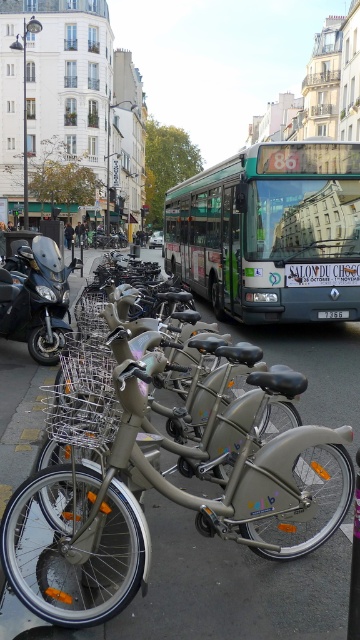
From the picture: You are standing on the sidewalk in front of the Velib bicycles. You want to walk to the bus stop located at the end of the street. The bus stop is 5 meters away from you. Can you walk directly to the bus stop without stepping on the gray asphalt at center?

The gray asphalt at center is 2.84 meters away from you. Since the bus stop is 5 meters away, you can walk around the gray asphalt at center and reach the bus stop without stepping on it.

You are a delivery person who needs to place a box on the gray asphalt at center. The box is 1 meter tall. Can the box be placed there without exceeding the height limit imposed by the green metallic bus at center?

The gray asphalt at center has a lesser height compared to the green metallic bus at center. Since the asphalt is lower, the box can be placed there as its height won

You are a delivery person who needs to park your motorcycle near the Velib bicycles. The motorcycle must be placed to the left of the bus. Given that the green metallic bus at center is already positioned to the right of the matte black motorcycle at left, is your motorcycle already in the correct position?

Yes, the matte black motorcycle at left is already positioned to the left of the green metallic bus at center, so it meets the requirement.